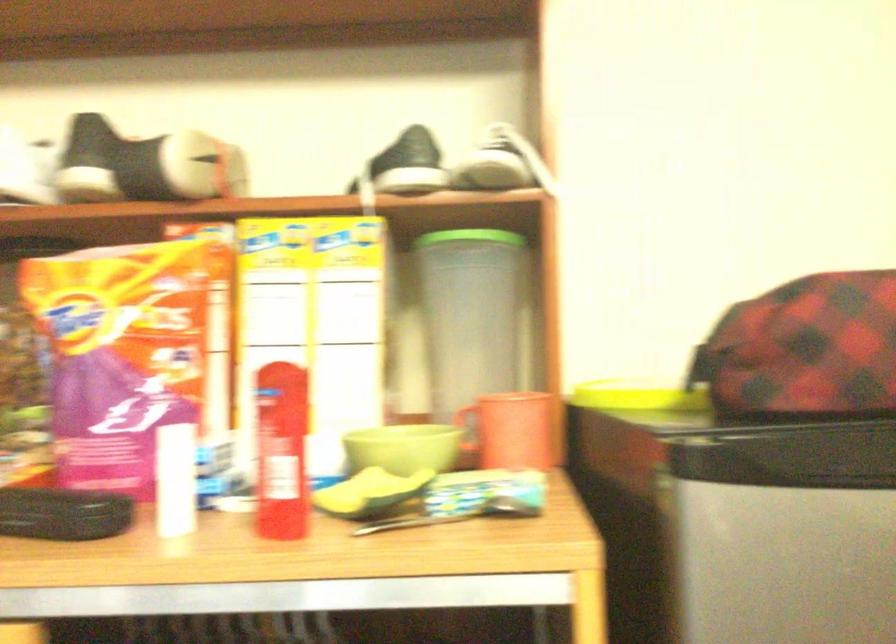
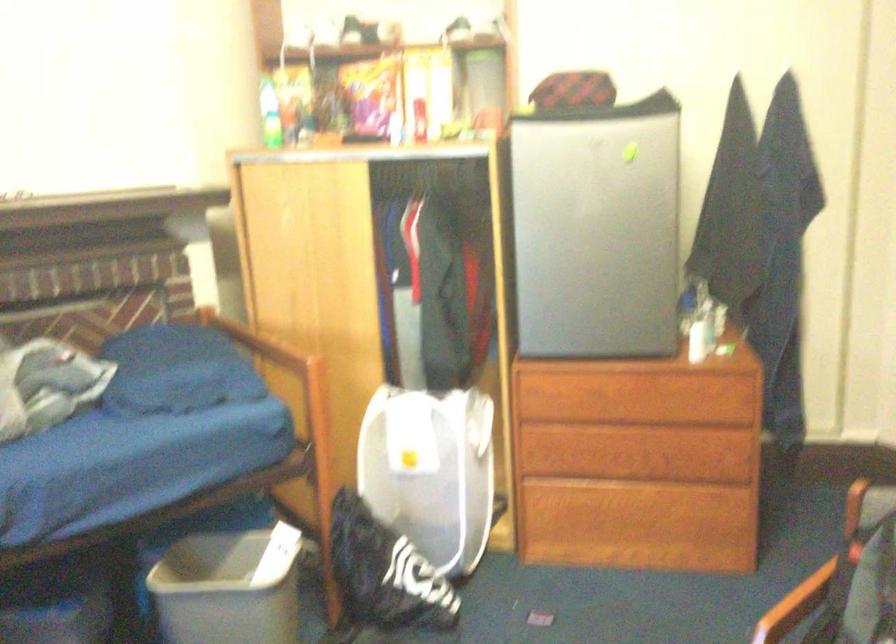
Question: The images are taken continuously from a first-person perspective. In which direction are you moving?

Choices:
 (A) Left
 (B) Right
 (C) Forward
 (D) Backward

Answer: (D)